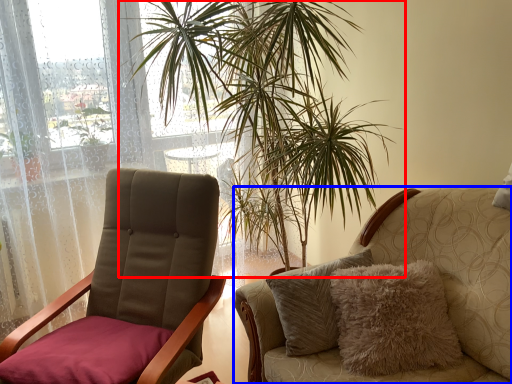
Question: Which object is further to the camera taking this photo, houseplant (highlighted by a red box) or chair (highlighted by a blue box)?

Choices:
 (A) houseplant
 (B) chair

Answer: (A)